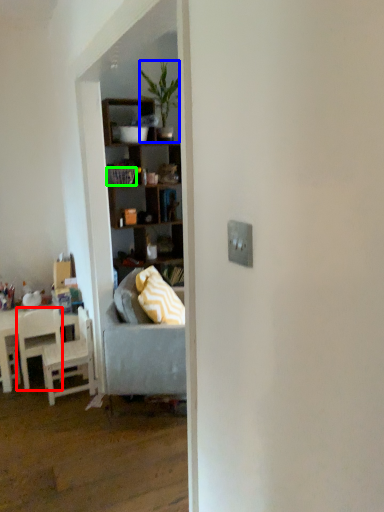
Question: Estimate the real-world distances between objects in this image. Which object is farther from chair (highlighted by a red box), houseplant (highlighted by a blue box) or picnic basket (highlighted by a green box)?

Choices:
 (A) houseplant
 (B) picnic basket

Answer: (A)